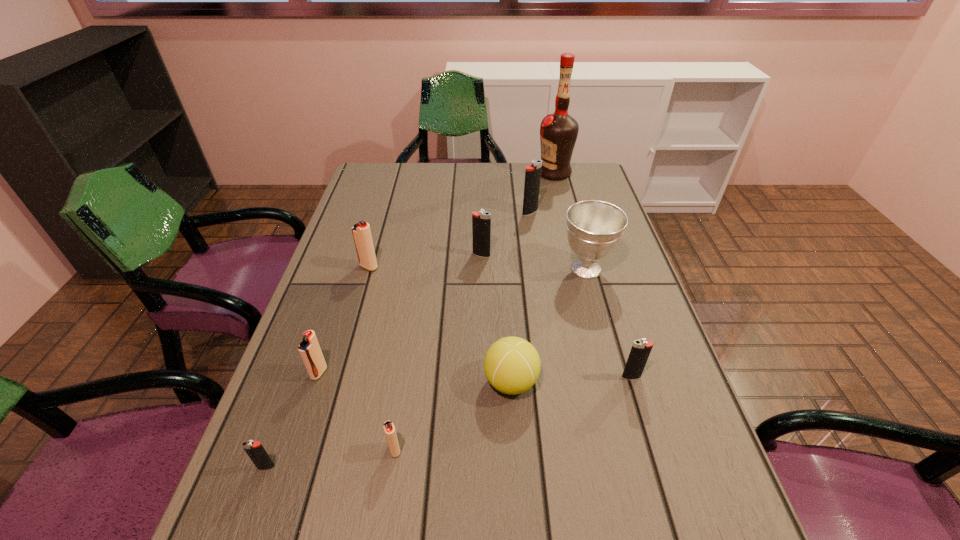
Find the location of a particular element. Image resolution: width=960 pixels, height=540 pixels. unoccupied position between the third object from left to right and the second farthest igniter is located at coordinates (425, 261).

The width and height of the screenshot is (960, 540). What are the coordinates of `vacant space in between the green tennis ball and the smallest red igniter` in the screenshot? It's located at (453, 416).

The height and width of the screenshot is (540, 960). In order to click on free space between the second biggest red igniter and the farthest object in this screenshot , I will do `click(437, 273)`.

I want to click on free space between the farthest igniter and the green tennis ball, so click(520, 297).

You are a GUI agent. You are given a task and a screenshot of the screen. Output one action in this format:
    pyautogui.click(x=<x>, y=<y>)
    Task: Click on the free space between the tennis ball and the second farthest black igniter
    
    Given the screenshot: What is the action you would take?
    pyautogui.click(x=496, y=319)

I want to click on empty location between the tallest object and the nearest object, so click(410, 320).

Identify which object is the second closest to the nearest red igniter. Please provide its 2D coordinates. Your answer should be formatted as a tuple, i.e. [(x, y)], where the tuple contains the x and y coordinates of a point satisfying the conditions above.

[(256, 452)]

This screenshot has height=540, width=960. I want to click on the ninth closest object to the second nearest igniter, so pos(558,132).

Select which igniter appears as the second closest to the nearest object. Please provide its 2D coordinates. Your answer should be formatted as a tuple, i.e. [(x, y)], where the tuple contains the x and y coordinates of a point satisfying the conditions above.

[(389, 429)]

Point out which igniter is positioned as the second nearest to the sixth igniter from left to right. Please provide its 2D coordinates. Your answer should be formatted as a tuple, i.e. [(x, y)], where the tuple contains the x and y coordinates of a point satisfying the conditions above.

[(361, 231)]